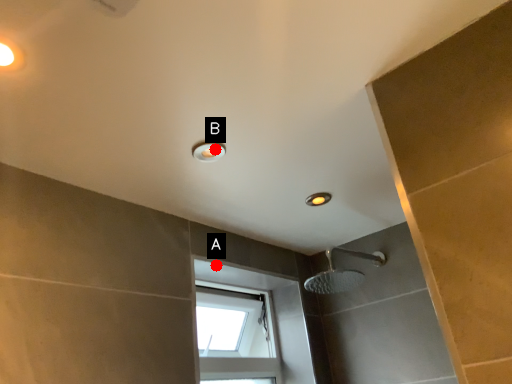
Question: Two points are circled on the image, labeled by A and B beside each circle. Which of the following is the closest to the observer?

Choices:
 (A) A is closer
 (B) B is closer

Answer: (B)